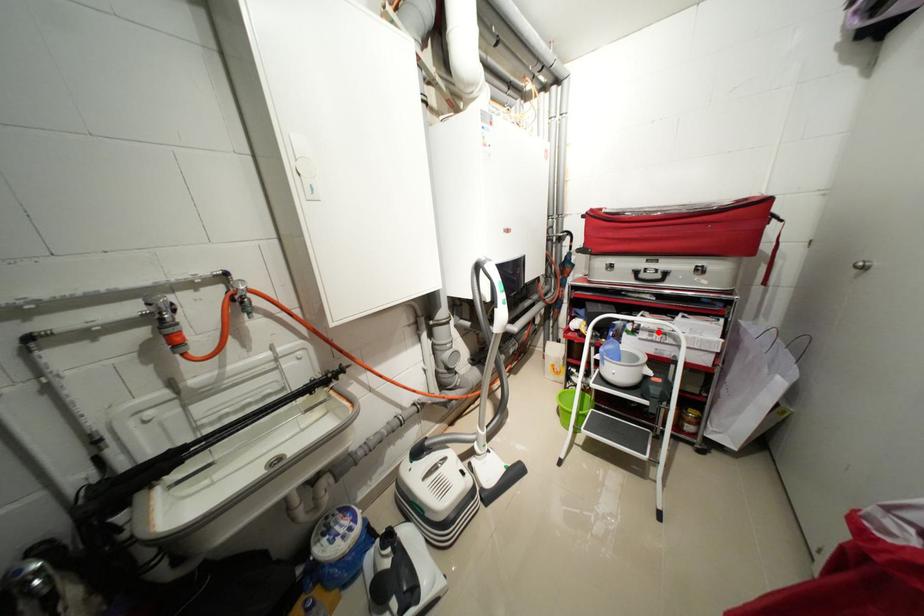
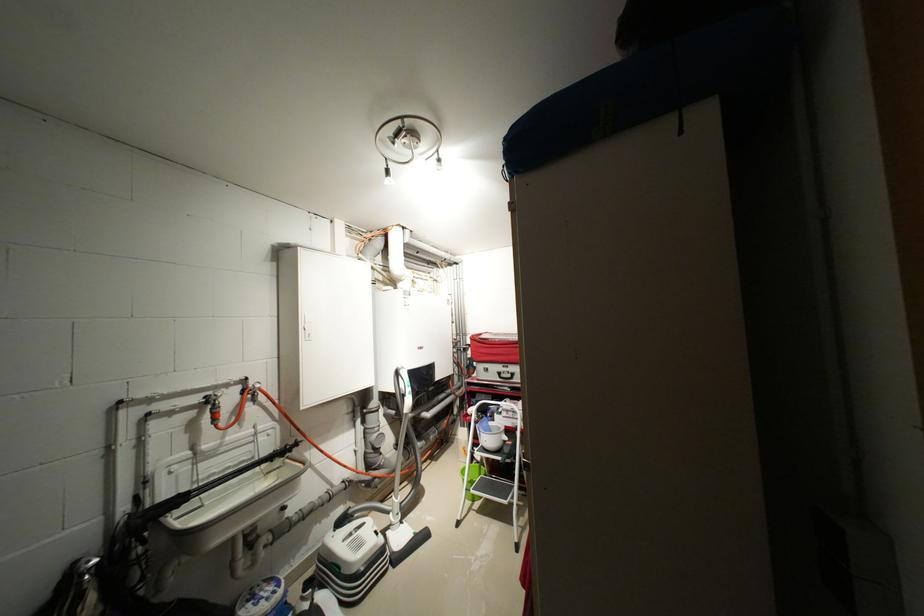
Locate, in the second image, the point that corresponds to the highlighted location in the first image.

(515, 411)